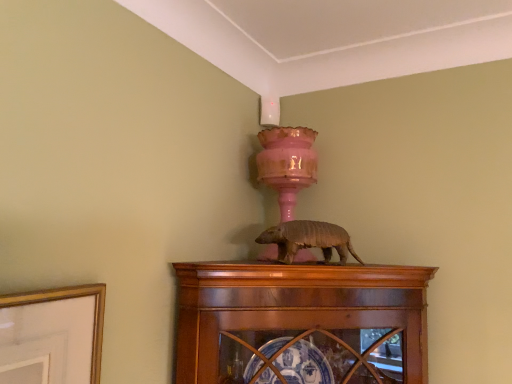
The width and height of the screenshot is (512, 384). I want to click on brown matte armadillo at center, so click(x=308, y=240).

The image size is (512, 384). What do you see at coordinates (308, 240) in the screenshot?
I see `brown matte armadillo at center` at bounding box center [308, 240].

This screenshot has height=384, width=512. I want to click on brown matte armadillo at center, so pyautogui.click(x=308, y=240).